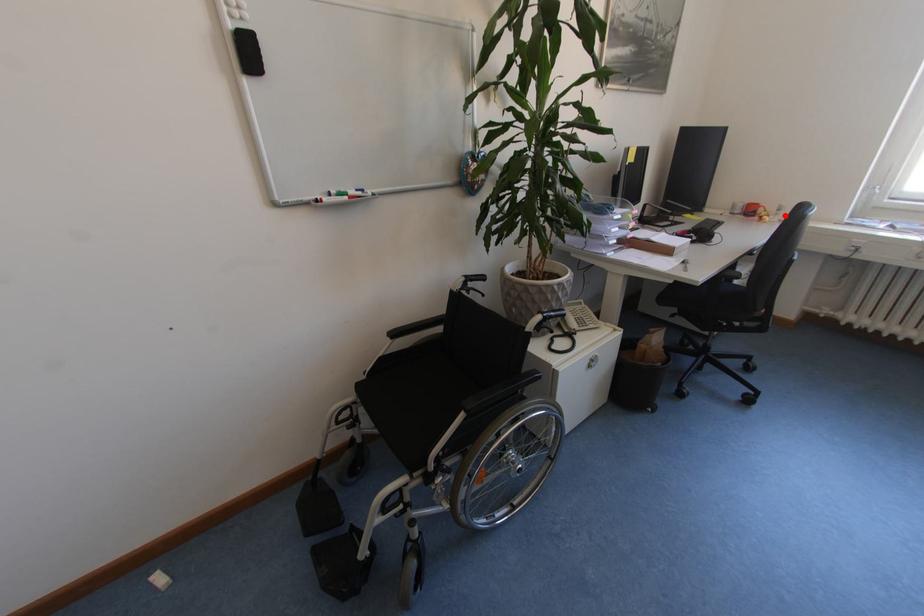
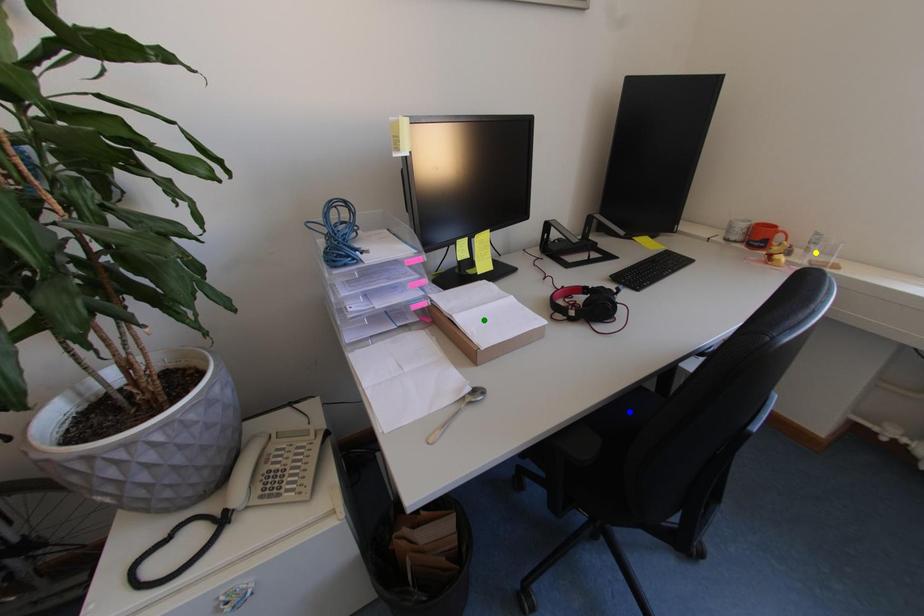
Question: I am providing you with two images of the same scene from different viewpoints. A red point is marked on the first image. You are given multiple points on the second image. Which spot in image 2 lines up with the point in image 1?

Choices:
 (A) blue point
 (B) yellow point
 (C) green point

Answer: (B)